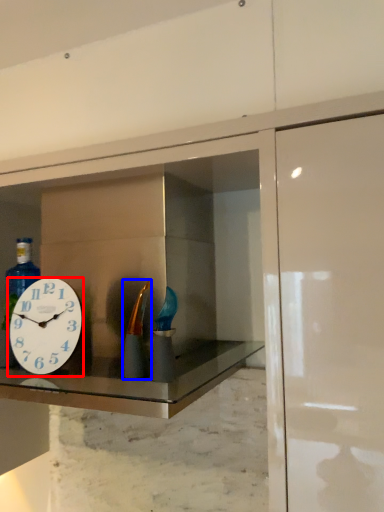
Question: Which point is closer to the camera, wall clock (highlighted by a red box) or bottle (highlighted by a blue box)?

Choices:
 (A) wall clock
 (B) bottle

Answer: (B)